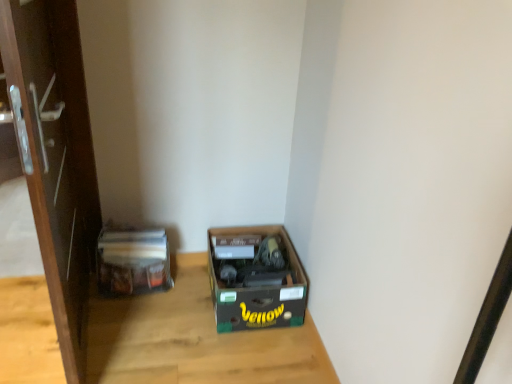
Find the location of a particular element. The width and height of the screenshot is (512, 384). blank space to the left of brown glossy door at left is located at coordinates (29, 326).